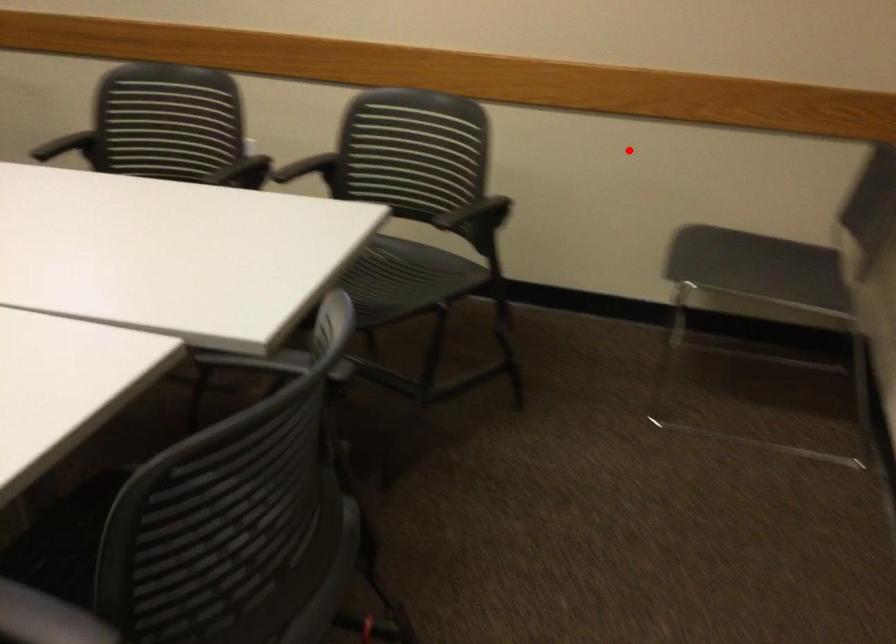
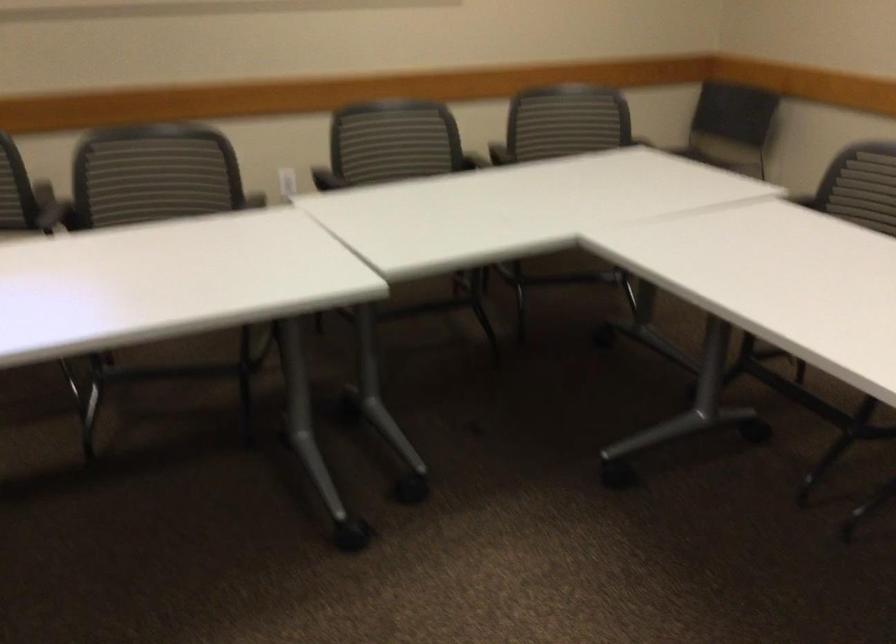
Question: I am providing you with two images of the same scene from different viewpoints. A red point is marked on the first image. At the location where the point appears in image 1, is it still visible in image 2?

Choices:
 (A) Yes
 (B) No

Answer: (A)